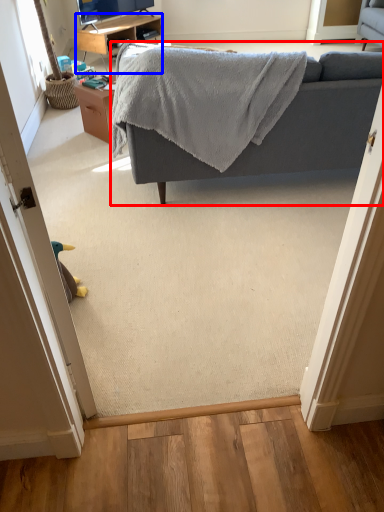
Question: Which object is further to the camera taking this photo, studio couch (highlighted by a red box) or desk (highlighted by a blue box)?

Choices:
 (A) studio couch
 (B) desk

Answer: (B)